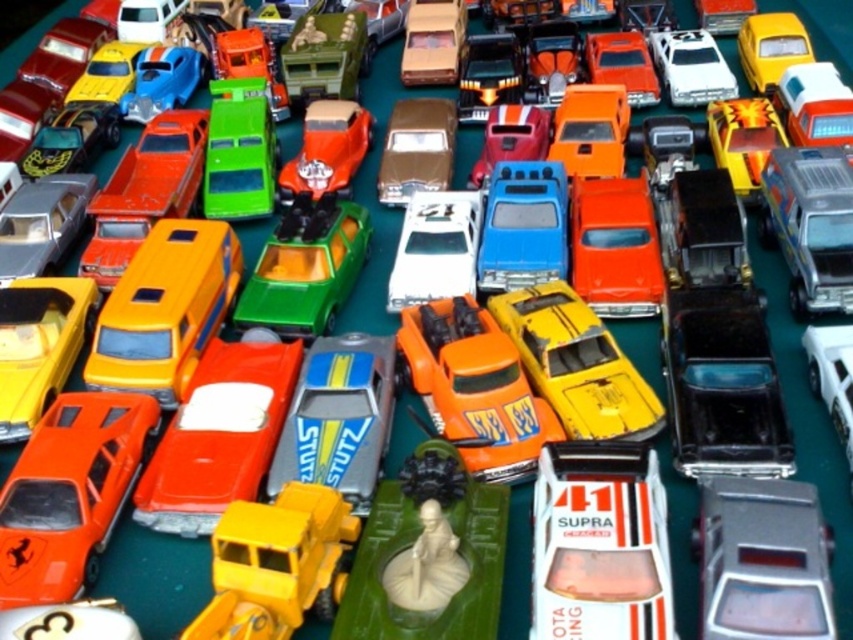
You are organizing a toy car collection and need to place the orange matte supra at lower left and the blue plastic car at center into a new display case. The display case has a transparent front that is at the top. Which car will be visible from the front of the display case?

The blue plastic car at center will be visible from the front of the display case because the orange matte supra at lower left is located below it.

You are a toy collector trying to fit all your cars into a display case. The orange matte supra at lower left and the shiny metallic car at upper right need to be placed side by side. Which car should you place first to ensure they fit properly?

The orange matte supra at lower left is shorter than the shiny metallic car at upper right. To fit them side by side, place the shorter orange matte supra at lower left first to accommodate the taller shiny metallic car at upper right.